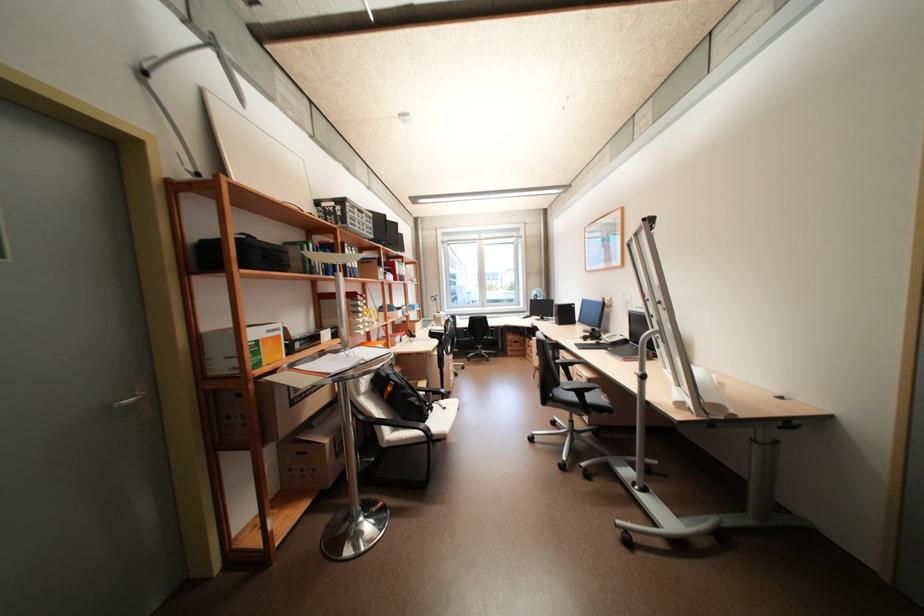
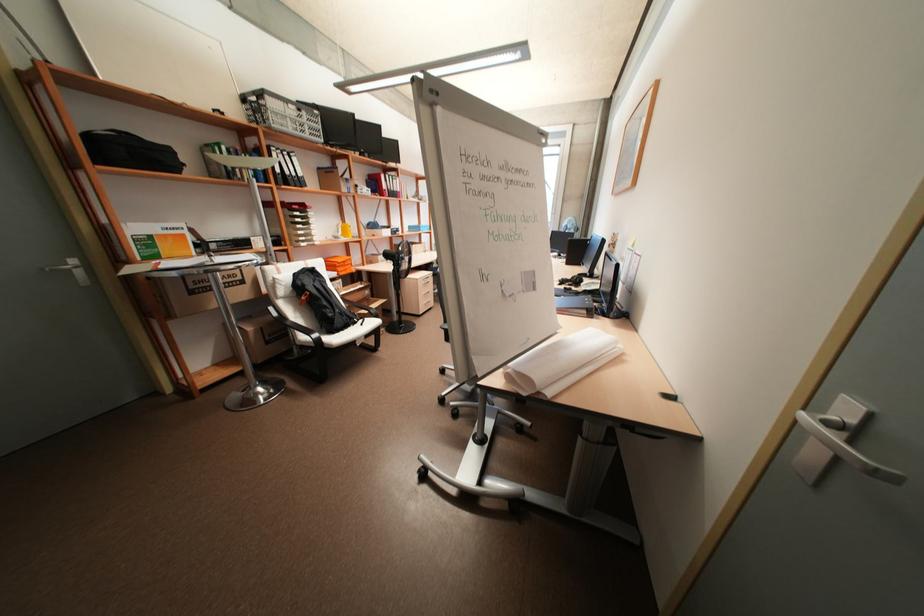
Where in the second image is the point corresponding to the point at 727,416 from the first image?

(530, 394)